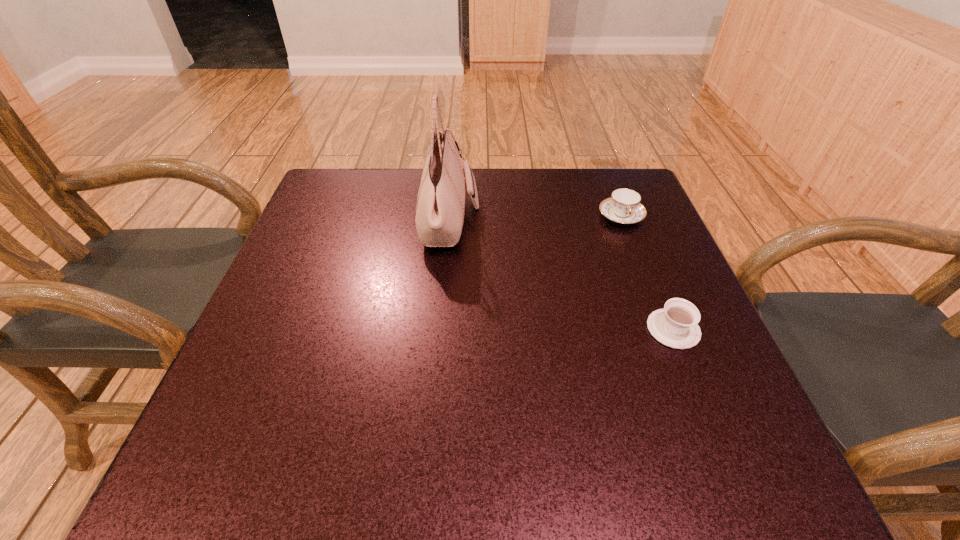
Locate which object ranks second in proximity to the leftmost object. Please provide its 2D coordinates. Your answer should be formatted as a tuple, i.e. [(x, y)], where the tuple contains the x and y coordinates of a point satisfying the conditions above.

[(676, 326)]

Where is `free region that satisfies the following two spatial constraints: 1. on the handle side of the nearer teacup; 2. on the side of the handbag with the attached pouch`? The width and height of the screenshot is (960, 540). free region that satisfies the following two spatial constraints: 1. on the handle side of the nearer teacup; 2. on the side of the handbag with the attached pouch is located at coordinates point(629,220).

What are the coordinates of `vacant point that satisfies the following two spatial constraints: 1. on the side with the handle of the farther teacup; 2. on the side of the handbag with the attached pouch` in the screenshot? It's located at (622, 220).

Find the location of `free spot that satisfies the following two spatial constraints: 1. on the side of the handbag with the attached pouch; 2. on the handle side of the shorter teacup`. free spot that satisfies the following two spatial constraints: 1. on the side of the handbag with the attached pouch; 2. on the handle side of the shorter teacup is located at coordinates (441, 329).

The height and width of the screenshot is (540, 960). What are the coordinates of `free space that satisfies the following two spatial constraints: 1. on the side with the handle of the farther teacup; 2. on the side of the leftmost object with the attached pouch` in the screenshot? It's located at (622, 220).